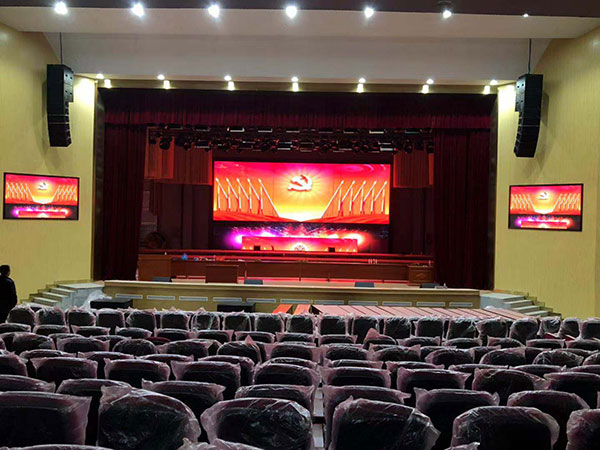
Identify the location of yellow wall. Image resolution: width=600 pixels, height=450 pixels. (32, 235), (557, 268).